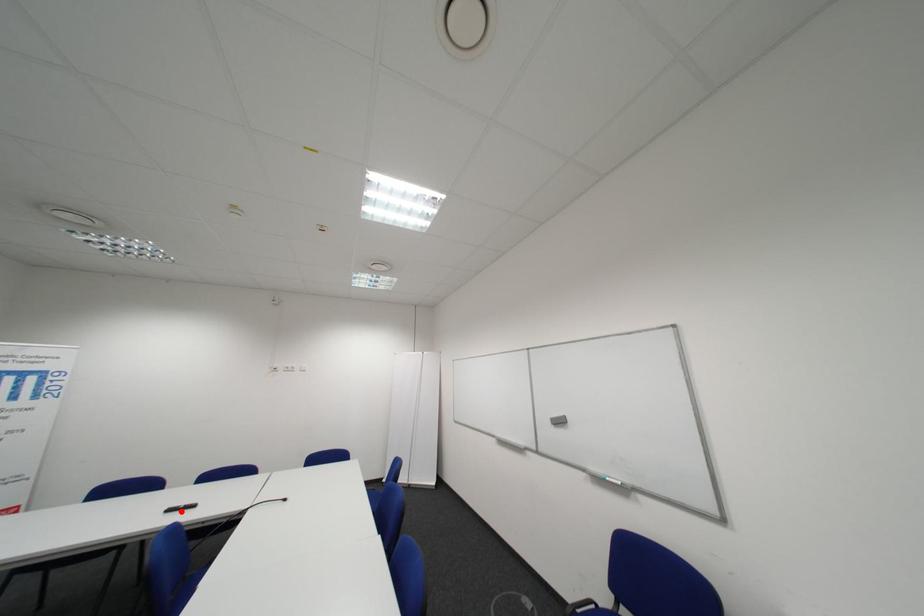
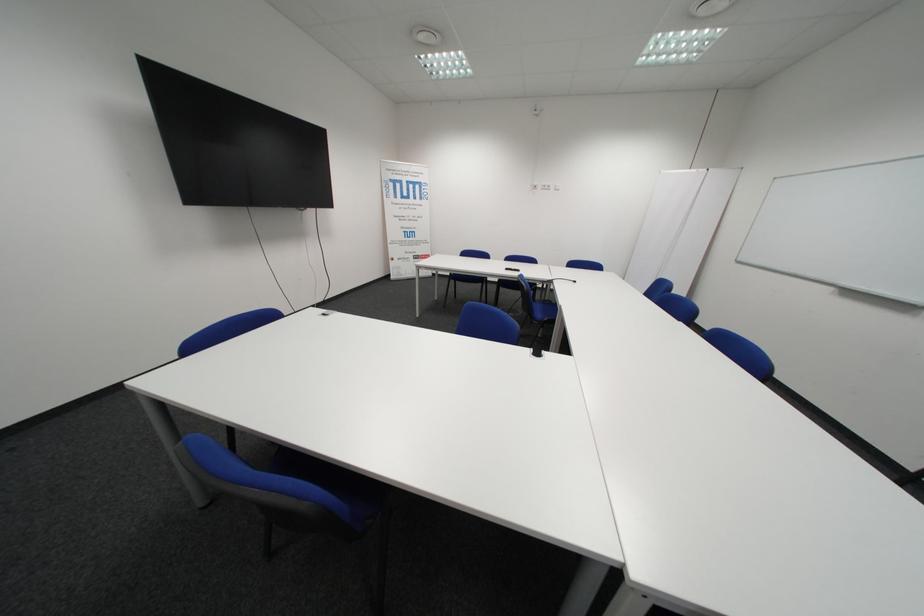
Locate, in the second image, the point that corresponds to the highlighted location in the first image.

(518, 270)